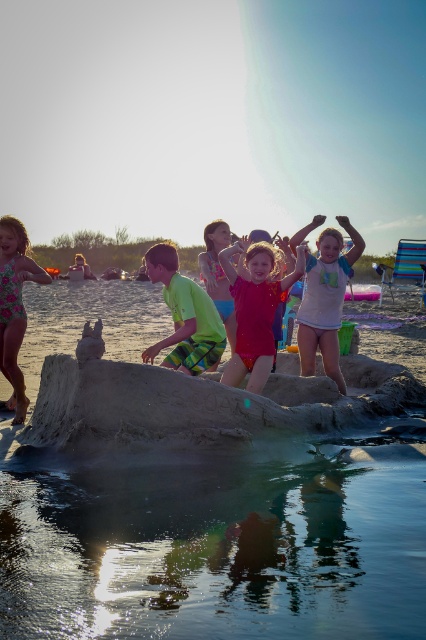
You are standing at the point with coordinates point (x=5, y=228) and want to walk to the point with coordinates point (x=149, y=266). Which direction should you face to walk directly towards your destination?

You should face north because point (x=149, y=266) is in front of point (x=5, y=228).

You are a parent at the beach and see your child in the floral print swimsuit at left. You want to ensure they stay near the clear water at sand center. Is the child currently positioned above or below the water?

The floral print swimsuit at left is positioned above the clear water at sand center, so the child is currently above the water.